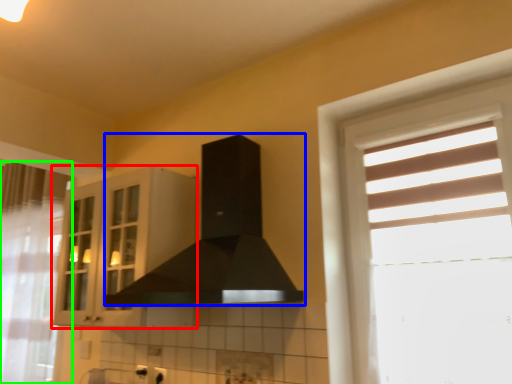
Question: Which object is the closest to the cabinetry (highlighted by a red box)? Choose among these: fume hood (highlighted by a blue box) or curtain (highlighted by a green box).

Choices:
 (A) fume hood
 (B) curtain

Answer: (A)